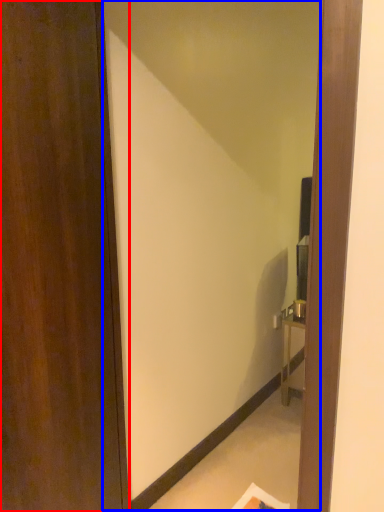
Question: Which of the following is the farthest to the observer, door (highlighted by a red box) or mirror (highlighted by a blue box)?

Choices:
 (A) door
 (B) mirror

Answer: (B)